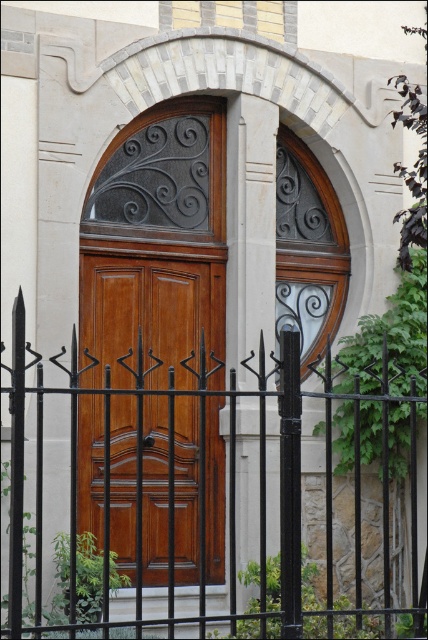
Question: Does black wrought iron fence at center have a smaller size compared to wooden door at center?

Choices:
 (A) no
 (B) yes

Answer: (A)

Question: Does black wrought iron fence at center have a lesser width compared to wooden door at center?

Choices:
 (A) no
 (B) yes

Answer: (A)

Question: Among these objects, which one is farthest from the camera?

Choices:
 (A) wooden door at center
 (B) black wrought iron fence at center

Answer: (A)

Question: Can you confirm if black wrought iron fence at center is smaller than wooden door at center?

Choices:
 (A) yes
 (B) no

Answer: (B)

Question: Which of the following is the farthest from the observer?

Choices:
 (A) black wrought iron fence at center
 (B) wooden door at center

Answer: (B)